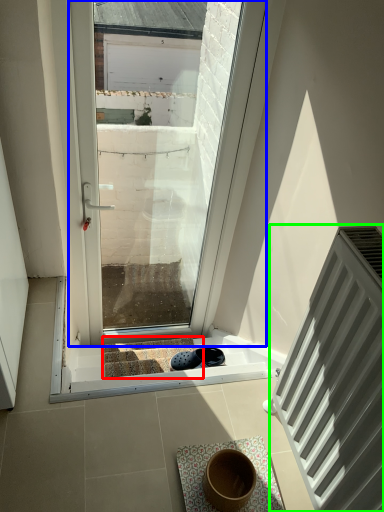
Question: Which object is positioned farthest from stairwell (highlighted by a red box)? Select from window (highlighted by a blue box) and radiator (highlighted by a green box).

Choices:
 (A) window
 (B) radiator

Answer: (A)